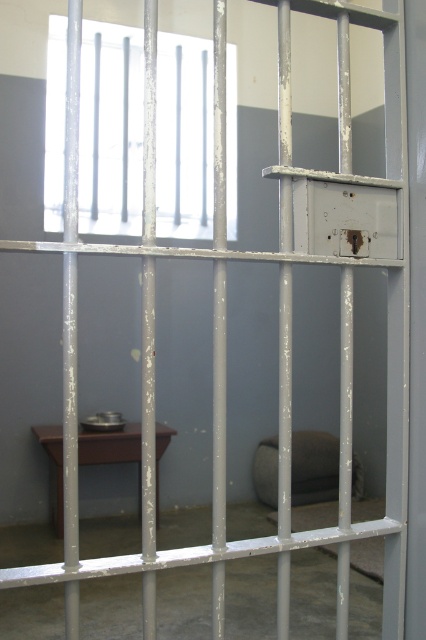
Question: Considering the real-world distances, which object is farthest from the brown fabric stool at center?

Choices:
 (A) transparent glass window at upper center
 (B) brown matte stool at lower left

Answer: (A)

Question: Observing the image, what is the correct spatial positioning of transparent glass window at upper center in reference to brown matte stool at lower left?

Choices:
 (A) right
 (B) left

Answer: (B)

Question: Among these objects, which one is farthest from the camera?

Choices:
 (A) brown matte stool at lower left
 (B) transparent glass window at upper center

Answer: (B)

Question: Can you confirm if brown fabric stool at center is wider than brown matte stool at lower left?

Choices:
 (A) no
 (B) yes

Answer: (A)

Question: From the image, what is the correct spatial relationship of brown fabric stool at center in relation to brown matte stool at lower left?

Choices:
 (A) below
 (B) above

Answer: (A)

Question: Among these points, which one is farthest from the camera?

Choices:
 (A) (206, 65)
 (B) (101, 442)

Answer: (A)